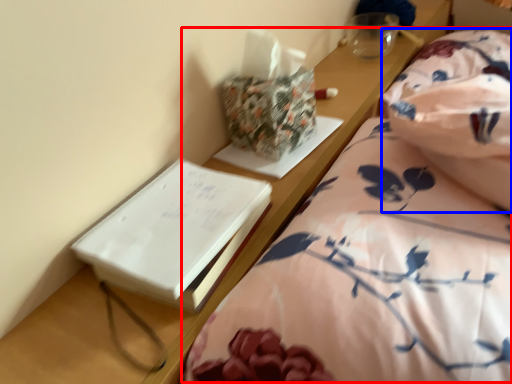
Question: Which point is further to the camera, bed (highlighted by a red box) or blanket (highlighted by a blue box)?

Choices:
 (A) bed
 (B) blanket

Answer: (B)